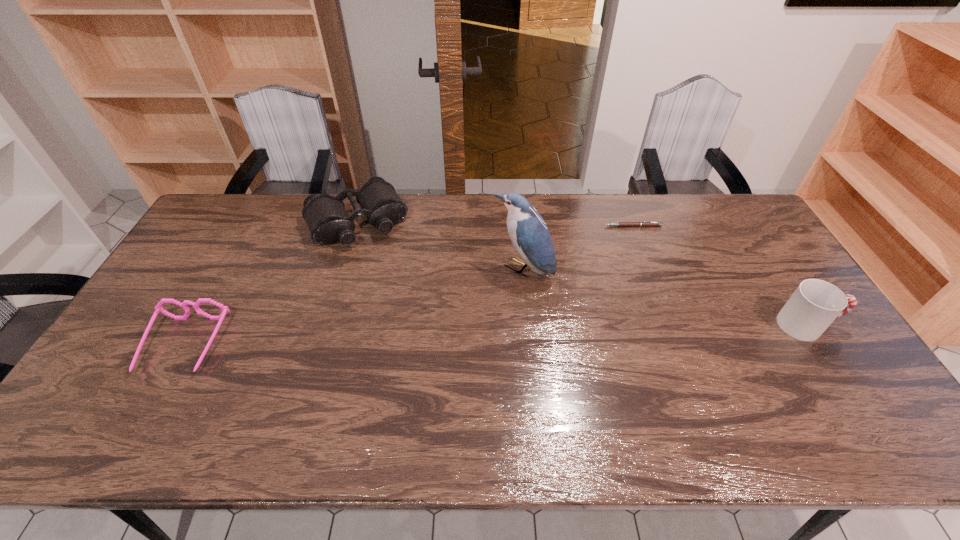
You are a GUI agent. You are given a task and a screenshot of the screen. Output one action in this format:
    pyautogui.click(x=<x>, y=<y>)
    Task: Click on the leftmost object
    
    Given the screenshot: What is the action you would take?
    pyautogui.click(x=158, y=307)

The width and height of the screenshot is (960, 540). I want to click on spectacles, so click(158, 307).

Locate an element on the screen. the rightmost object is located at coordinates [815, 304].

Locate an element on the screen. The height and width of the screenshot is (540, 960). the tallest object is located at coordinates (529, 234).

The image size is (960, 540). I want to click on the third farthest object, so click(x=529, y=234).

Where is `the second object from right to left`? The height and width of the screenshot is (540, 960). the second object from right to left is located at coordinates (620, 224).

The image size is (960, 540). What are the coordinates of `pen` in the screenshot? It's located at (620, 224).

Locate an element on the screen. The height and width of the screenshot is (540, 960). binoculars is located at coordinates (328, 221).

Where is `the third shortest object`? Image resolution: width=960 pixels, height=540 pixels. the third shortest object is located at coordinates (328, 221).

Locate an element on the screen. vacant space located at the tip of the bird's beak is located at coordinates (490, 300).